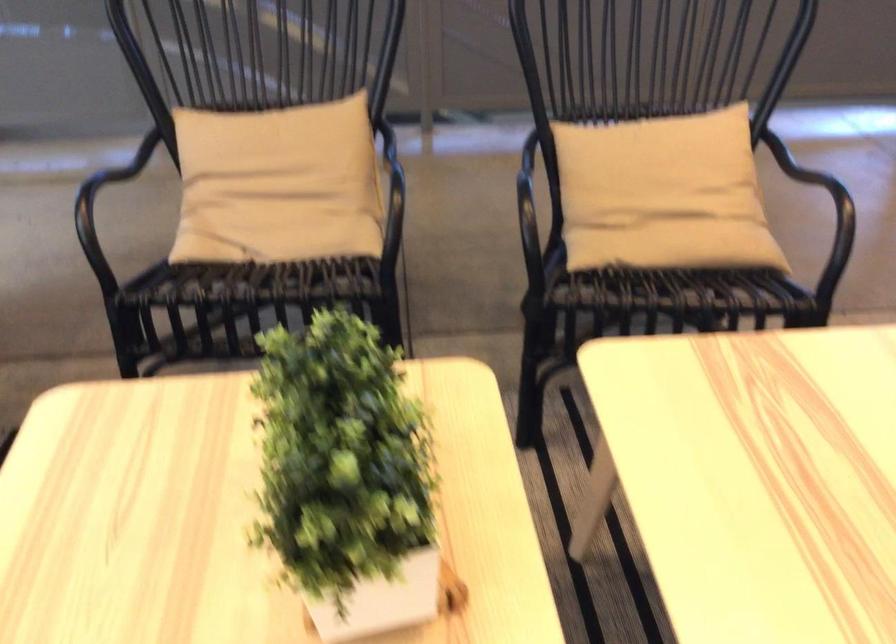
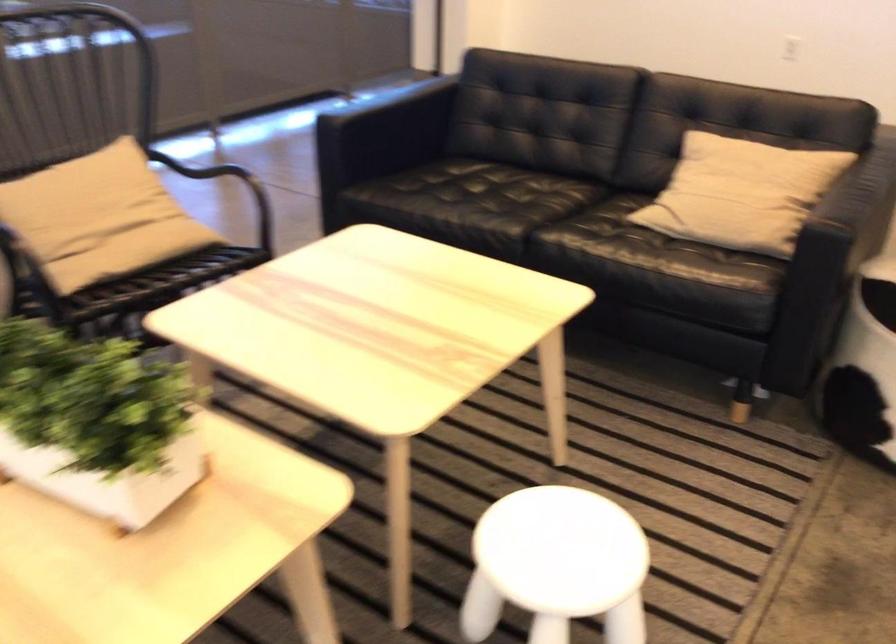
In the second image, find the point that corresponds to point (668, 182) in the first image.

(99, 214)